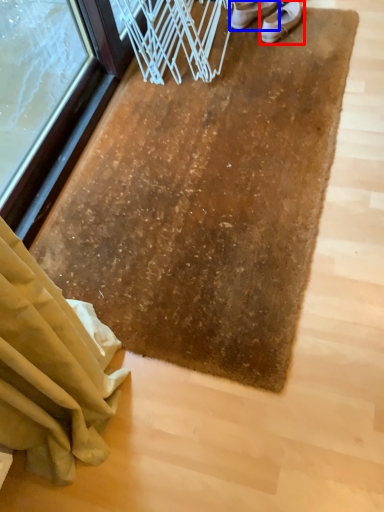
Question: Among these objects, which one is farthest to the camera, footwear (highlighted by a red box) or footwear (highlighted by a blue box)?

Choices:
 (A) footwear
 (B) footwear

Answer: (B)